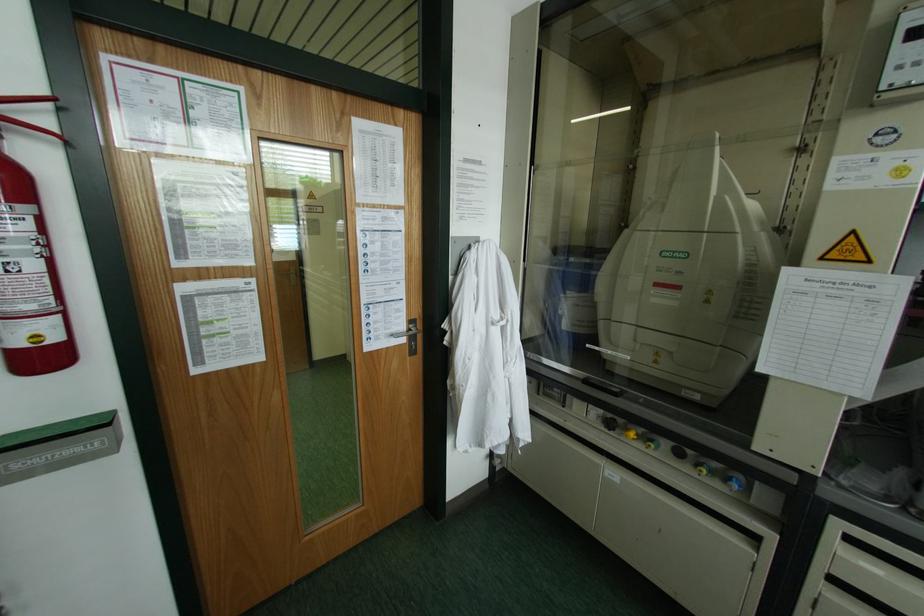
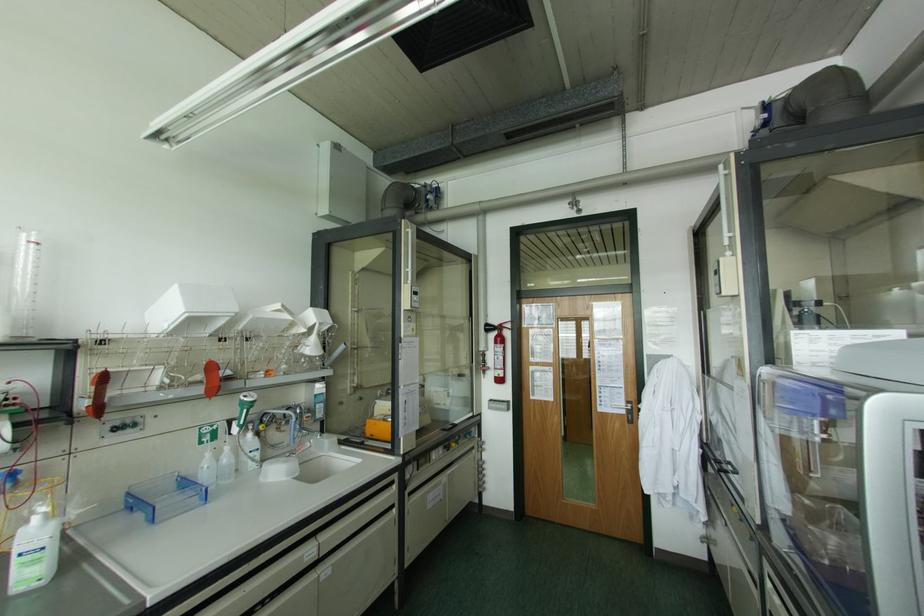
Find the pixel in the second image that matches (409,321) in the first image.

(626, 400)